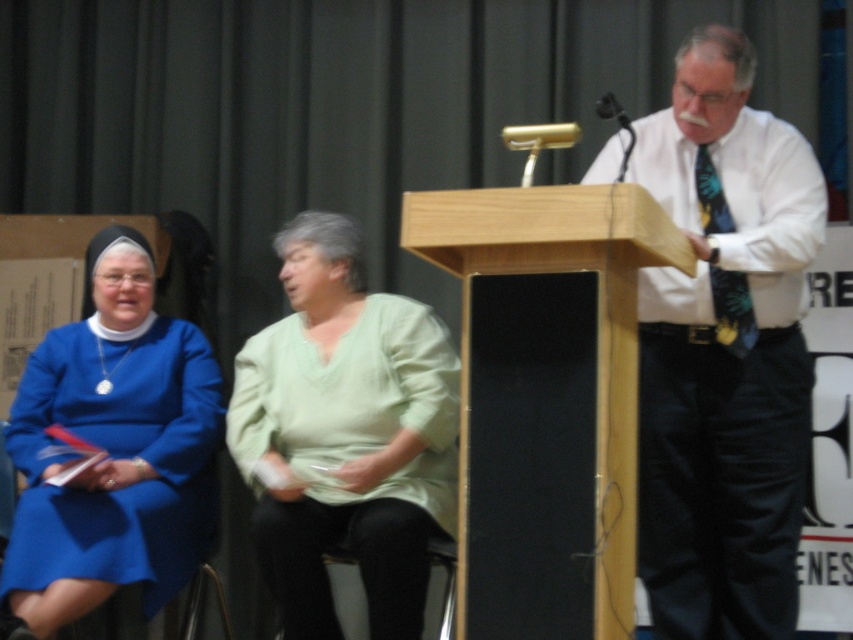
Is white shirt at center above green cotton shirt at center?

Indeed, white shirt at center is positioned over green cotton shirt at center.

What do you see at coordinates (722, 348) in the screenshot? The image size is (853, 640). I see `white shirt at center` at bounding box center [722, 348].

Is point (701, 385) behind point (322, 481)?

No, it is in front of (322, 481).

Find the location of a particular element. white shirt at center is located at coordinates (722, 348).

Which of these two, white shirt at center or blue fabric dress at left, stands shorter?

blue fabric dress at left is shorter.

Is white shirt at center bigger than blue fabric dress at left?

No, white shirt at center is not bigger than blue fabric dress at left.

Locate an element on the screen. white shirt at center is located at coordinates (722, 348).

Based on the photo, which of these two, blue fabric dress at left or floral silk tie at right, stands shorter?

Standing shorter between the two is floral silk tie at right.

Who is positioned more to the right, blue fabric dress at left or floral silk tie at right?

Positioned to the right is floral silk tie at right.

Identify the location of blue fabric dress at left. The image size is (853, 640). (112, 451).